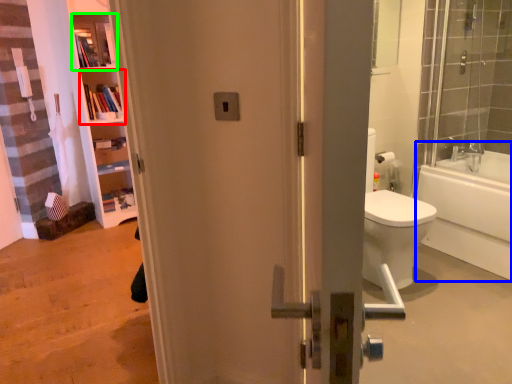
Question: Based on their relative distances, which object is farther from shelf (highlighted by a red box)? Choose from bathtub (highlighted by a blue box) and shelf (highlighted by a green box).

Choices:
 (A) bathtub
 (B) shelf

Answer: (A)